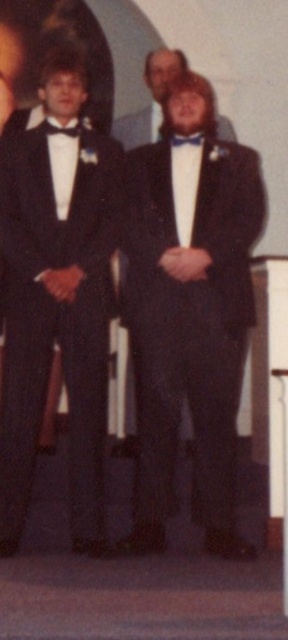
Question: Considering the real-world distances, which object is farthest from the blue satin bow tie at center?

Choices:
 (A) matte black suit at center
 (B) matte black tuxedo at left

Answer: (B)

Question: Is matte black tuxedo at left below blue satin bow tie at center?

Choices:
 (A) no
 (B) yes

Answer: (B)

Question: Which is nearer to the blue satin bow tie at center?

Choices:
 (A) matte black tuxedo at left
 (B) matte black suit at center

Answer: (B)

Question: Can you confirm if matte black tuxedo at left is thinner than blue satin bow tie at center?

Choices:
 (A) no
 (B) yes

Answer: (A)

Question: Does matte black suit at center have a smaller size compared to blue satin bow tie at center?

Choices:
 (A) no
 (B) yes

Answer: (A)

Question: Which object is the farthest from the matte black suit at center?

Choices:
 (A) matte black tuxedo at left
 (B) blue satin bow tie at center

Answer: (A)